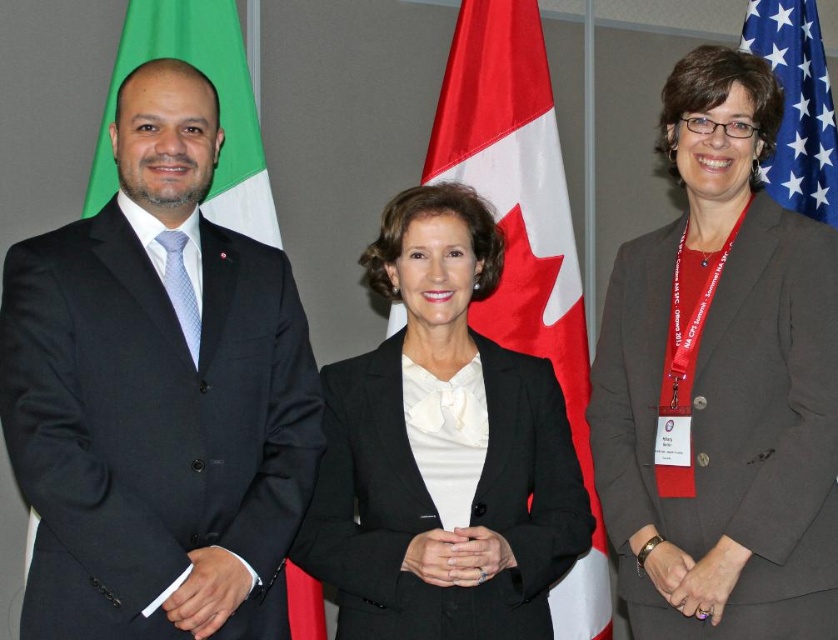
You are standing in front of the image and want to determine which of the two points, point (499, 570) or point (804, 26), is nearer to you. Based on the scene description, which point is closer?

Point (499, 570) is closer to the viewer than point (804, 26).

You are taking a photo of the three individuals standing in front of the backdrop with flags. You want to focus on the person at point (516, 406) and the person at point (492, 202). Which of these two people will appear larger in your photo?

The person at point (516, 406) will appear larger in the photo because it is closer to the camera than point (492, 202).